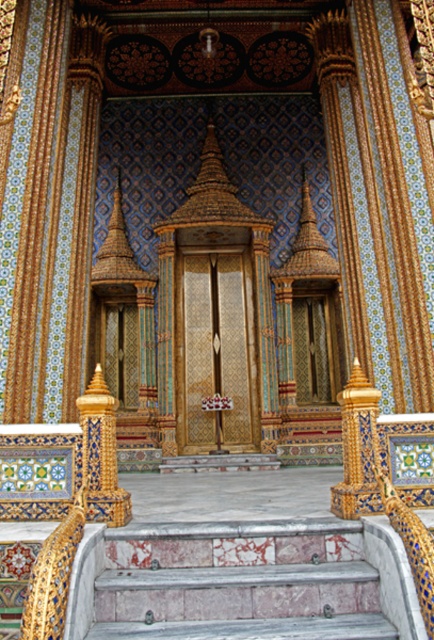
Question: Does marble steps at center have a larger size compared to gold/gilded stone pillar at center?

Choices:
 (A) no
 (B) yes

Answer: (A)

Question: Can you confirm if marble steps at center is wider than gold/gilded stone pillar at center?

Choices:
 (A) no
 (B) yes

Answer: (B)

Question: Is marble steps at center smaller than gold/gilded stone pillar at center?

Choices:
 (A) no
 (B) yes

Answer: (B)

Question: Which of the following is the farthest from the observer?

Choices:
 (A) marble steps at center
 (B) gold/gilded stone pillar at center

Answer: (B)

Question: Among these objects, which one is nearest to the camera?

Choices:
 (A) marble steps at center
 (B) gold/gilded stone pillar at center

Answer: (A)